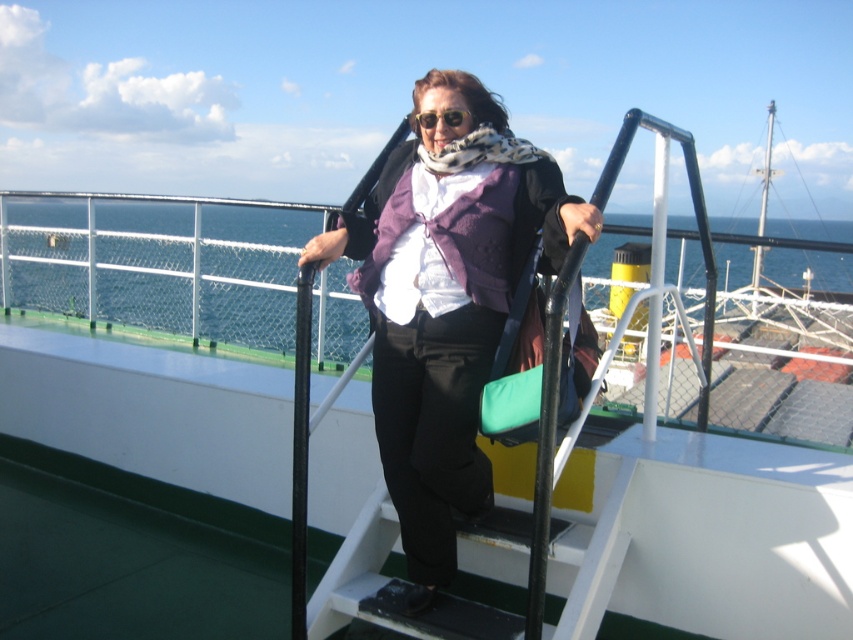
Question: Which of the following is the closest to the observer?

Choices:
 (A) matte black sunglasses at center
 (B) blue water at upper center

Answer: (A)

Question: Among these objects, which one is farthest from the camera?

Choices:
 (A) matte black sunglasses at center
 (B) blue water at upper center

Answer: (B)

Question: Estimate the real-world distances between objects in this image. Which object is farther from the matte black sunglasses at center?

Choices:
 (A) purple woolen vest at center
 (B) blue water at upper center

Answer: (B)

Question: Can you confirm if blue water at upper center is positioned below matte black sunglasses at center?

Choices:
 (A) yes
 (B) no

Answer: (B)

Question: Can you confirm if blue water at upper center is wider than matte black sunglasses at center?

Choices:
 (A) no
 (B) yes

Answer: (B)

Question: Is purple woolen vest at center below blue water at upper center?

Choices:
 (A) no
 (B) yes

Answer: (B)